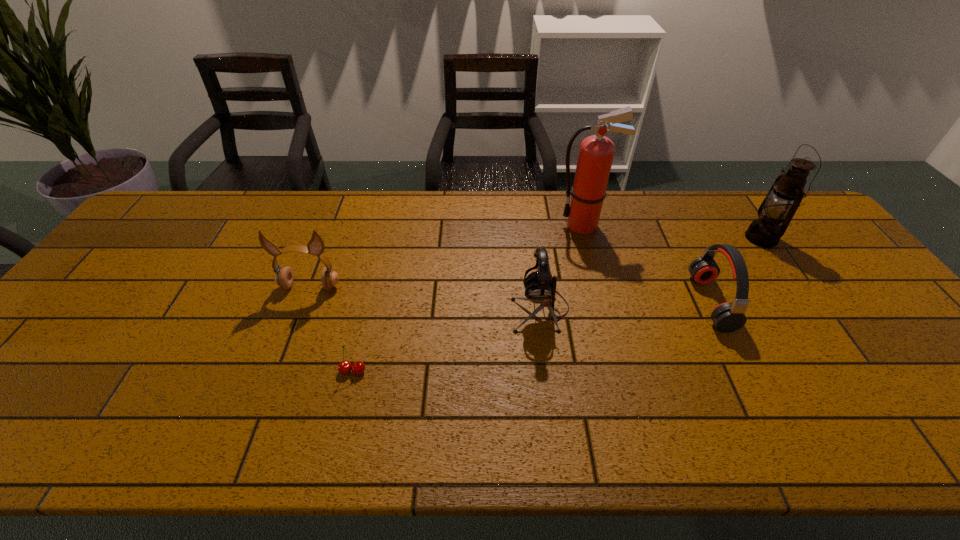
Find the location of a particular element. The width and height of the screenshot is (960, 540). vacant area that lies between the leftmost earphone and the shortest object is located at coordinates (331, 329).

The width and height of the screenshot is (960, 540). I want to click on vacant space that is in between the leftmost object and the fifth object from left to right, so click(x=511, y=295).

At what (x,y) coordinates should I click in order to perform the action: click on vacant space in between the second tallest object and the fifth object from right to left. Please return your answer as a coordinate pair (x, y). The height and width of the screenshot is (540, 960). Looking at the image, I should click on (557, 305).

Locate an element on the screen. This screenshot has height=540, width=960. free point between the leftmost earphone and the second tallest object is located at coordinates (536, 262).

Identify the location of vacant space in between the leftmost earphone and the second earphone from left to right. The height and width of the screenshot is (540, 960). (425, 299).

Locate an element on the screen. This screenshot has width=960, height=540. free space that is in between the third object from right to left and the second earphone from left to right is located at coordinates (562, 267).

Image resolution: width=960 pixels, height=540 pixels. What are the coordinates of `free spot between the third object from right to left and the second object from right to left` in the screenshot? It's located at (647, 264).

Where is `free space between the leftmost earphone and the second object from left to right`? This screenshot has height=540, width=960. free space between the leftmost earphone and the second object from left to right is located at coordinates (331, 329).

Point out which object is positioned as the third nearest to the second earphone from left to right. Please provide its 2D coordinates. Your answer should be formatted as a tuple, i.e. [(x, y)], where the tuple contains the x and y coordinates of a point satisfying the conditions above.

[(344, 367)]

Select which object appears as the closest to the cherry. Please provide its 2D coordinates. Your answer should be formatted as a tuple, i.e. [(x, y)], where the tuple contains the x and y coordinates of a point satisfying the conditions above.

[(284, 277)]